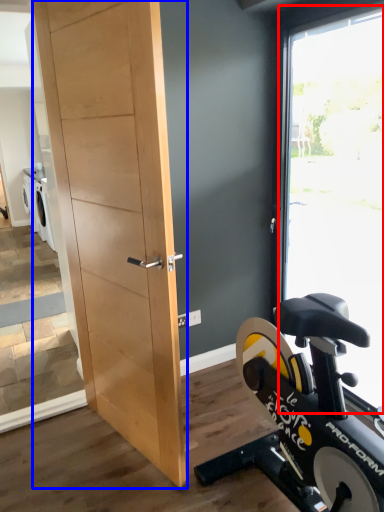
Question: Among these objects, which one is farthest to the camera, window (highlighted by a red box) or barn door (highlighted by a blue box)?

Choices:
 (A) window
 (B) barn door

Answer: (A)